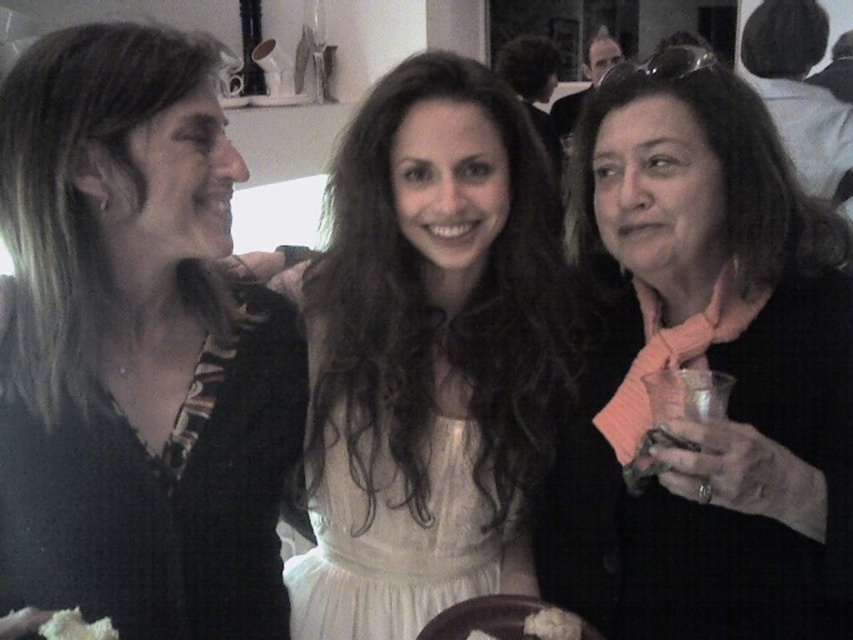
Question: In this image, where is black matte shirt at left located relative to white crumbly food at lower left?

Choices:
 (A) left
 (B) right

Answer: (A)

Question: Does pink fabric scarf at right come behind white fluffy bread at lower center?

Choices:
 (A) yes
 (B) no

Answer: (B)

Question: Which of the following is the farthest from the observer?

Choices:
 (A) (631, 410)
 (B) (508, 289)

Answer: (B)

Question: Does pink fabric scarf at right come in front of white fluffy bread at lower center?

Choices:
 (A) no
 (B) yes

Answer: (B)

Question: Among these objects, which one is farthest from the camera?

Choices:
 (A) white fluffy bread at lower center
 (B) black matte shirt at left

Answer: (A)

Question: Which is nearer to the black matte shirt at left?

Choices:
 (A) white satin dress at center
 (B) pink fabric scarf at right

Answer: (A)